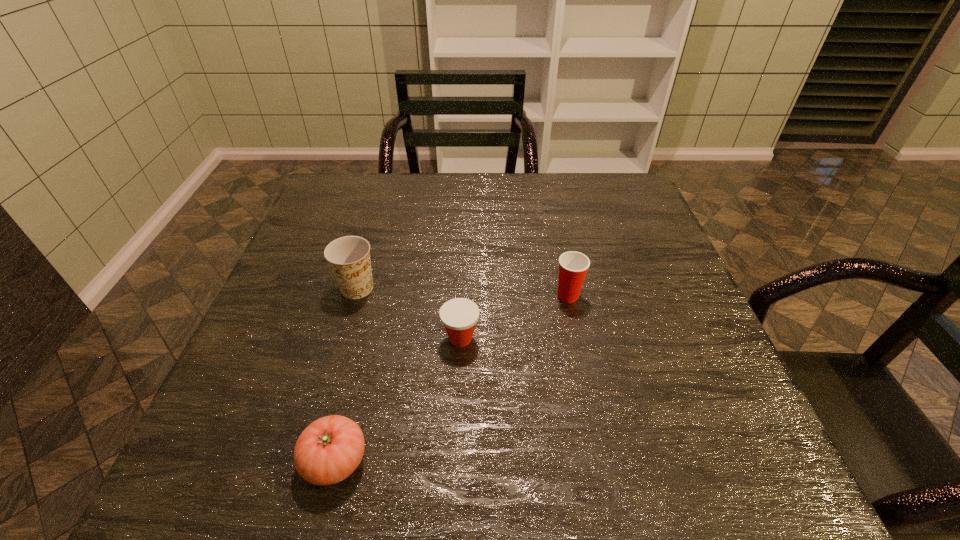
This screenshot has height=540, width=960. What are the coordinates of `object located in the left edge section of the desktop` in the screenshot? It's located at (349, 257).

Locate an element on the screen. free space at the far edge of the desktop is located at coordinates (521, 178).

Where is `vacant space at the near edge`? vacant space at the near edge is located at coordinates (438, 486).

This screenshot has height=540, width=960. In order to click on free space at the right edge of the desktop in this screenshot , I will do `click(663, 420)`.

Locate an element on the screen. The image size is (960, 540). vacant space at the far left corner is located at coordinates (371, 194).

You are a GUI agent. You are given a task and a screenshot of the screen. Output one action in this format:
    pyautogui.click(x=<x>, y=<y>)
    Task: Click on the free space at the near right corner of the desktop
    The image size is (960, 540).
    Given the screenshot: What is the action you would take?
    pyautogui.click(x=745, y=445)

The height and width of the screenshot is (540, 960). I want to click on free space between the leftmost Dixie cup and the nearest object, so click(x=347, y=374).

Locate an element on the screen. The height and width of the screenshot is (540, 960). empty space that is in between the tomato and the rightmost Dixie cup is located at coordinates (451, 378).

Identify the location of vacant region between the tomato and the rightmost Dixie cup. The image size is (960, 540). (451, 378).

Find the location of `empty space that is in between the tomato and the leftmost Dixie cup`. empty space that is in between the tomato and the leftmost Dixie cup is located at coordinates (347, 374).